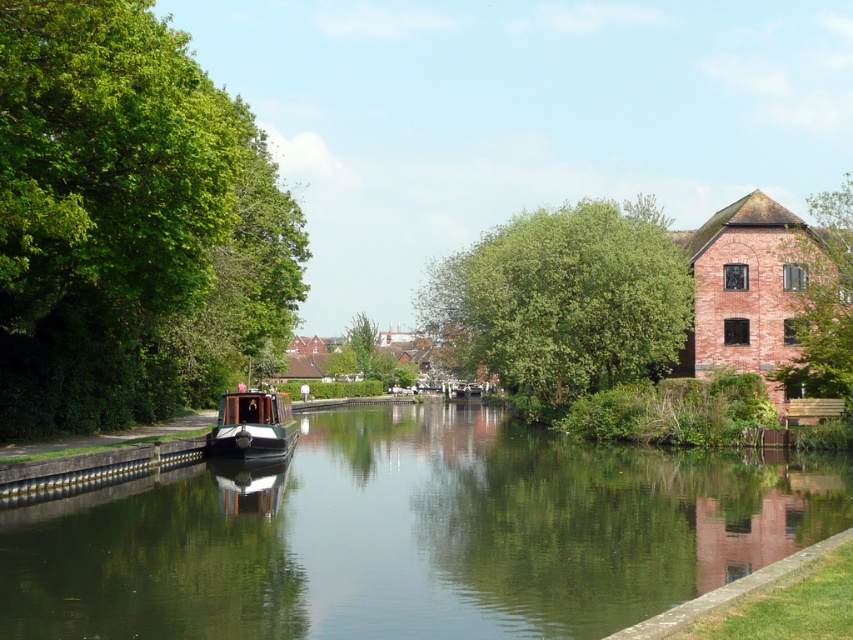
Does green leafy tree at left have a lesser height compared to green leafy tree at center?

Indeed, green leafy tree at left has a lesser height compared to green leafy tree at center.

The width and height of the screenshot is (853, 640). Describe the element at coordinates (129, 224) in the screenshot. I see `green leafy tree at left` at that location.

Where is `green leafy tree at left`? This screenshot has width=853, height=640. green leafy tree at left is located at coordinates (129, 224).

Who is positioned more to the right, green leafy tree at upper right or polished wood boat at center?

Positioned to the right is green leafy tree at upper right.

Is green leafy tree at upper right below polished wood boat at center?

Actually, green leafy tree at upper right is above polished wood boat at center.

What are the coordinates of `green leafy tree at upper right` in the screenshot? It's located at (822, 301).

In the scene shown: Does green smooth water at center have a greater height compared to green leafy tree at left?

No, green smooth water at center is not taller than green leafy tree at left.

You are a GUI agent. You are given a task and a screenshot of the screen. Output one action in this format:
    pyautogui.click(x=<x>, y=<y>)
    Task: Click on the green smooth water at center
    The width and height of the screenshot is (853, 640).
    Given the screenshot: What is the action you would take?
    pyautogui.click(x=412, y=534)

This screenshot has width=853, height=640. In order to click on green smooth water at center in this screenshot , I will do `click(412, 534)`.